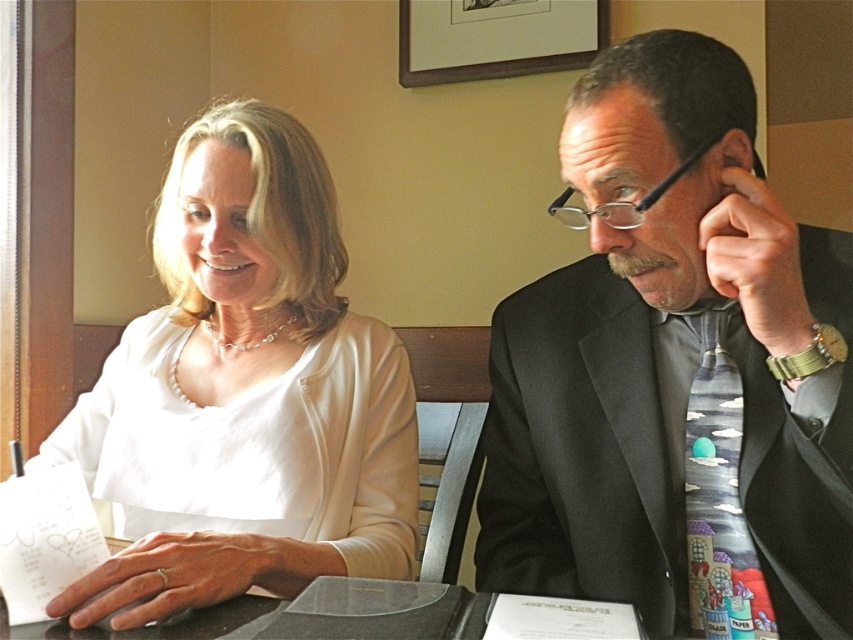
You are organizing a charity event and need to seat guests at a table where the distance between the two chairs must be exactly 1.2 meters. Given the current arrangement with the matte black suit at right and white matte blouse at upper left, will the guests be able to comfortably converse without leaning forward?

The matte black suit at right is narrower than the white matte blouse at upper left, but the description does not provide specific measurements of the distance between them. Therefore, it is unclear if the 1.2 meter requirement is met. You may need to measure the actual distance between the two chairs to ensure comfortable conversation.

You are organizing a charity event and need to arrange seating so that the person wearing the larger item between the matte black suit at right and the white matte blouse at upper left can sit closer to the stage. Which clothing item should you consider?

The white matte blouse at upper left is larger than the matte black suit at right, so the person wearing the white matte blouse at upper left should sit closer to the stage.